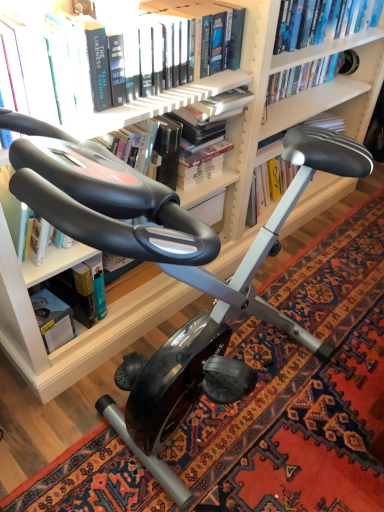
Question: From the image's perspective, is hardcover book at left, which is counted as the third book, starting from the front, above hardcover book at upper center, which appears as the 4th book when viewed from the front?

Choices:
 (A) yes
 (B) no

Answer: (B)

Question: Is hardcover book at left, which is counted as the third book, starting from the front, positioned with its back to hardcover book at upper center, which appears as the 4th book when viewed from the front?

Choices:
 (A) yes
 (B) no

Answer: (B)

Question: Does hardcover book at left, which is counted as the third book, starting from the front, have a lesser height compared to hardcover book at upper center, which appears as the 4th book when viewed from the front?

Choices:
 (A) no
 (B) yes

Answer: (A)

Question: From a real-world perspective, is hardcover book at left, the 2th book positioned from the back, beneath hardcover book at upper center, the 1th book from the back?

Choices:
 (A) no
 (B) yes

Answer: (B)

Question: Is hardcover book at lower left taller or shorter than hardcover book at left, which is counted as the third book, starting from the front?

Choices:
 (A) short
 (B) tall

Answer: (A)

Question: From the image's perspective, relative to hardcover book at left, the 2th book positioned from the back, is hardcover book at lower left above or below?

Choices:
 (A) above
 (B) below

Answer: (B)

Question: Is point (74, 330) positioned closer to the camera than point (87, 324)?

Choices:
 (A) closer
 (B) farther

Answer: (A)

Question: Based on their sizes in the image, would you say hardcover book at lower left is bigger or smaller than hardcover book at left, which is counted as the third book, starting from the front?

Choices:
 (A) small
 (B) big

Answer: (A)

Question: Considering their positions, is hardcover book at center, the 3th book positioned from the back, located in front of or behind hardcover book at left, which is counted as the third book, starting from the front?

Choices:
 (A) behind
 (B) front

Answer: (B)

Question: In terms of width, does hardcover book at center, the 3th book positioned from the back, look wider or thinner when compared to hardcover book at left, the 2th book positioned from the back?

Choices:
 (A) thin
 (B) wide

Answer: (B)

Question: Would you say hardcover book at center, positioned as the 2th book in front-to-back order, is to the left or to the right of hardcover book at left, the 2th book positioned from the back, in the picture?

Choices:
 (A) right
 (B) left

Answer: (A)

Question: Is point 107,141 closer or farther from the camera than point 84,296?

Choices:
 (A) closer
 (B) farther

Answer: (A)

Question: In terms of size, does black rubber exercise bike at center appear bigger or smaller than hardcover book at upper center, which appears as the 4th book when viewed from the front?

Choices:
 (A) small
 (B) big

Answer: (B)

Question: Considering the positions of point (321, 289) and point (281, 134), is point (321, 289) closer or farther from the camera than point (281, 134)?

Choices:
 (A) closer
 (B) farther

Answer: (B)